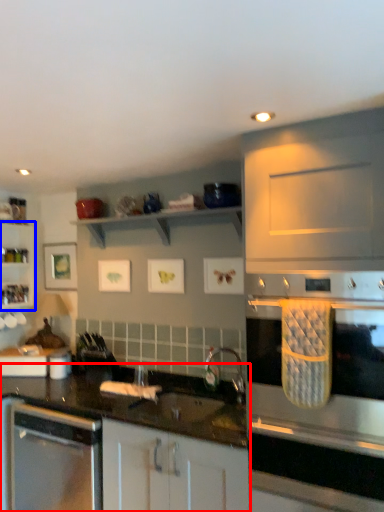
Question: Which object is further to the camera taking this photo, countertop (highlighted by a red box) or shelf (highlighted by a blue box)?

Choices:
 (A) countertop
 (B) shelf

Answer: (B)